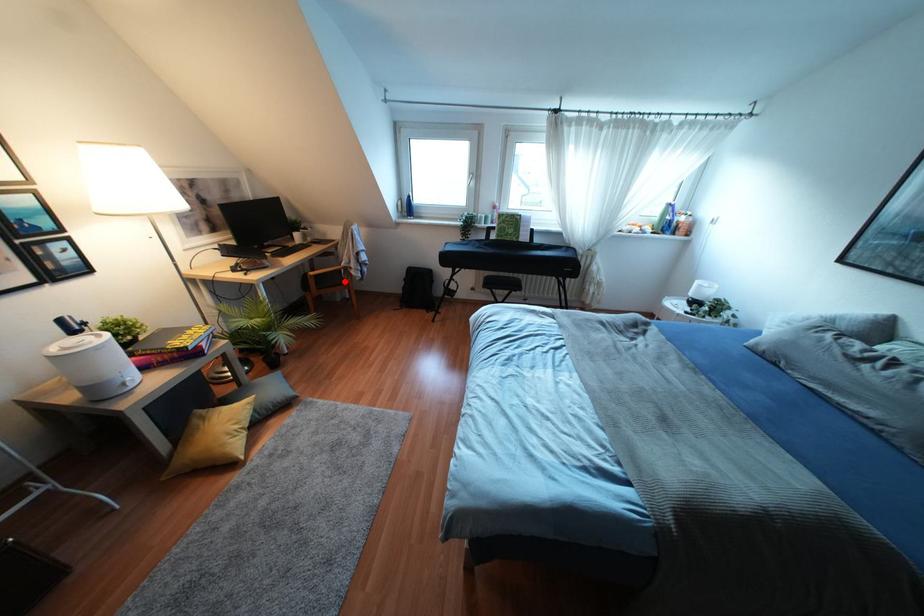
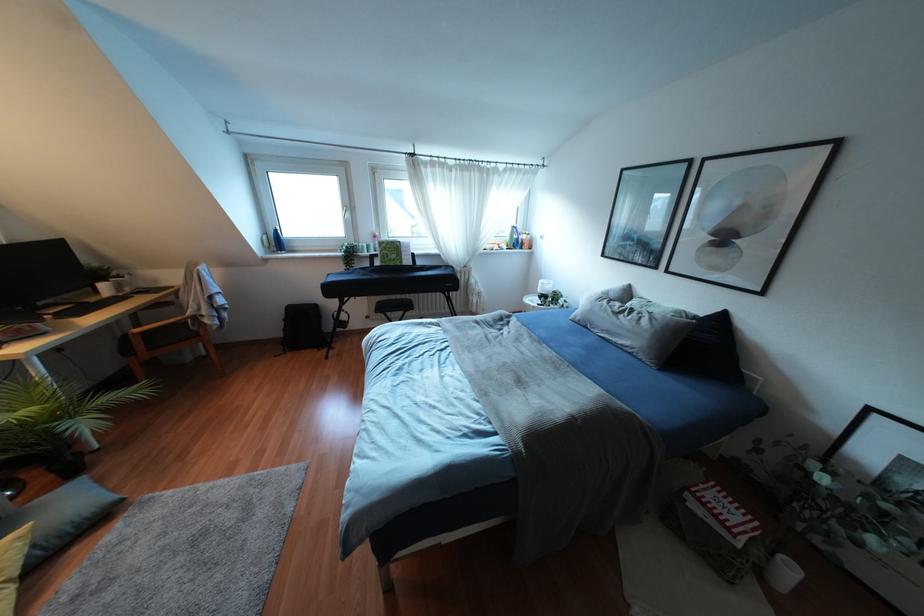
Question: I am providing you with two images of the same scene from different viewpoints. In image1, a red point is highlighted. Considering the same 3D point in image2, which of the following is correct?

Choices:
 (A) It is closer
 (B) It is farther

Answer: (B)